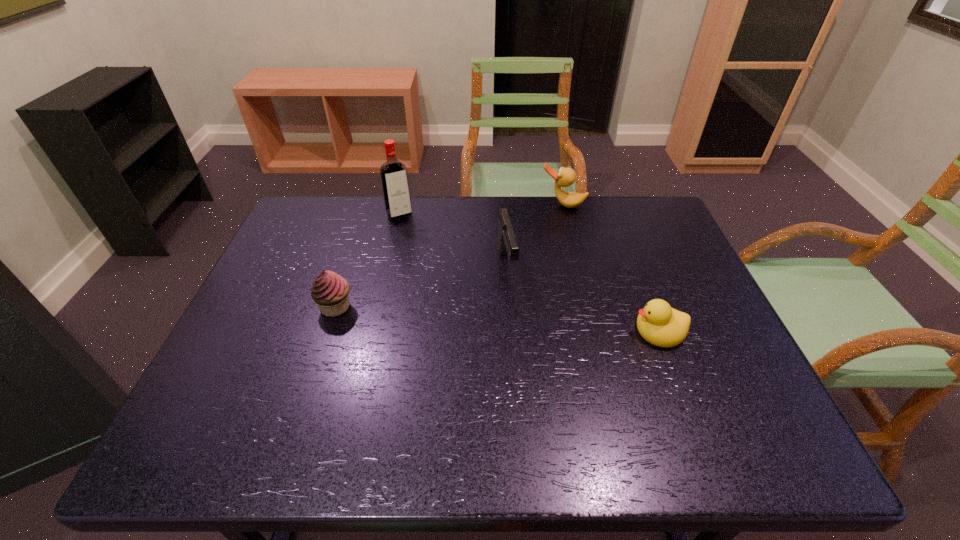
Locate which object ranks fourth in proximity to the fourth object from left to right. Please provide its 2D coordinates. Your answer should be formatted as a tuple, i.e. [(x, y)], where the tuple contains the x and y coordinates of a point satisfying the conditions above.

[(330, 291)]

Identify the location of free location that satisfies the following two spatial constraints: 1. on the front side of the duckling; 2. on the face of the tallest object. Image resolution: width=960 pixels, height=540 pixels. (373, 330).

Where is `free location that satisfies the following two spatial constraints: 1. on the back side of the third object from right to left; 2. on the right side of the second object from right to left`? The width and height of the screenshot is (960, 540). free location that satisfies the following two spatial constraints: 1. on the back side of the third object from right to left; 2. on the right side of the second object from right to left is located at coordinates (503, 205).

Locate an element on the screen. This screenshot has height=540, width=960. vacant space that satisfies the following two spatial constraints: 1. on the back side of the fourth object from left to right; 2. on the right side of the vodka is located at coordinates (402, 205).

This screenshot has width=960, height=540. Find the location of `vacant space that satisfies the following two spatial constraints: 1. on the front side of the vodka; 2. on the face of the rightmost object`. vacant space that satisfies the following two spatial constraints: 1. on the front side of the vodka; 2. on the face of the rightmost object is located at coordinates coord(373,330).

I want to click on vacant area in the image that satisfies the following two spatial constraints: 1. on the back side of the duck; 2. on the left side of the second object from left to right, so click(402, 205).

Image resolution: width=960 pixels, height=540 pixels. Identify the location of blank area in the image that satisfies the following two spatial constraints: 1. on the back side of the third object from left to right; 2. on the left side of the second object from right to left. (503, 205).

At what (x,y) coordinates should I click in order to perform the action: click on vacant region that satisfies the following two spatial constraints: 1. on the back side of the pistol; 2. on the right side of the duck. Please return your answer as a coordinate pair (x, y). The width and height of the screenshot is (960, 540). Looking at the image, I should click on coord(503,205).